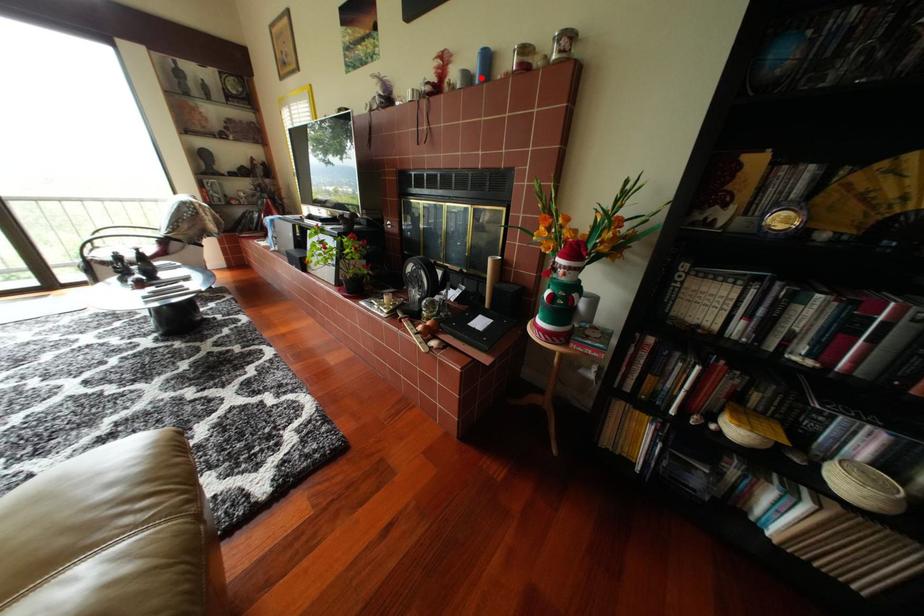
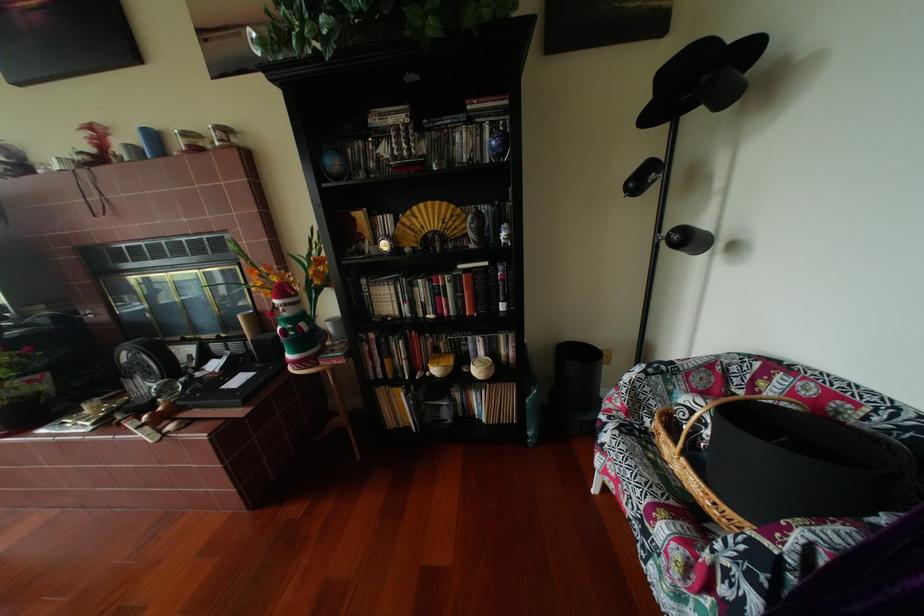
In the second image, find the point that corresponds to the highlighted location in the first image.

(149, 152)